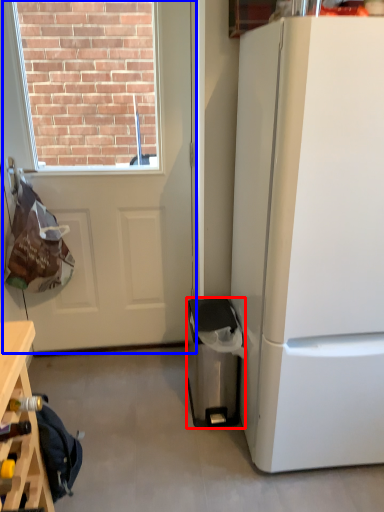
Question: Among these objects, which one is farthest to the camera, trash bin/can (highlighted by a red box) or door (highlighted by a blue box)?

Choices:
 (A) trash bin/can
 (B) door

Answer: (A)